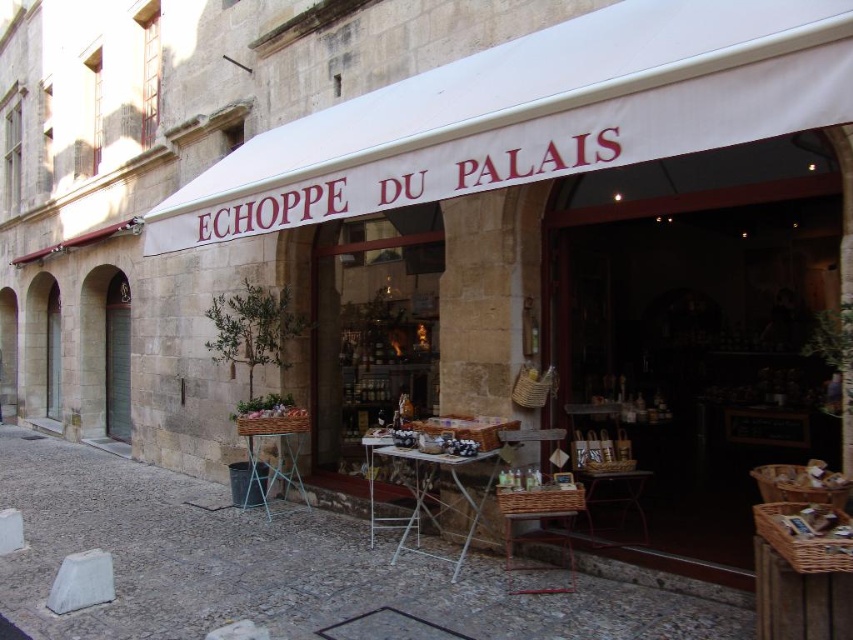
Is point (393, 563) farther from viewer compared to point (308, 499)?

No, it is in front of (308, 499).

Can you confirm if wooden folding table at center is shorter than metallic folding table at center?

No, wooden folding table at center is not shorter than metallic folding table at center.

Between point (405, 534) and point (281, 444), which one is positioned in front?

Point (405, 534) is in front.

This screenshot has height=640, width=853. Find the location of `wooden folding table at center`. wooden folding table at center is located at coordinates (432, 493).

Is point (248, 204) positioned before point (253, 452)?

Yes.

Measure the distance between white fabric canopy at upper center and metallic folding table at center.

white fabric canopy at upper center is 3.18 meters from metallic folding table at center.

You are a GUI agent. You are given a task and a screenshot of the screen. Output one action in this format:
    pyautogui.click(x=<x>, y=<y>)
    Task: Click on the white fabric canopy at upper center
    The image size is (853, 640).
    Given the screenshot: What is the action you would take?
    pyautogui.click(x=534, y=115)

Who is higher up, wooden crates at center or wooden folding table at center?

wooden folding table at center

Between wooden crates at center and wooden folding table at center, which one appears on the left side from the viewer's perspective?

Positioned to the left is wooden crates at center.

Which is behind, point (96, 540) or point (465, 490)?

The point (96, 540) is behind.

You are a GUI agent. You are given a task and a screenshot of the screen. Output one action in this format:
    pyautogui.click(x=<x>, y=<y>)
    Task: Click on the wooden crates at center
    This screenshot has height=640, width=853.
    Given the screenshot: What is the action you would take?
    pyautogui.click(x=273, y=564)